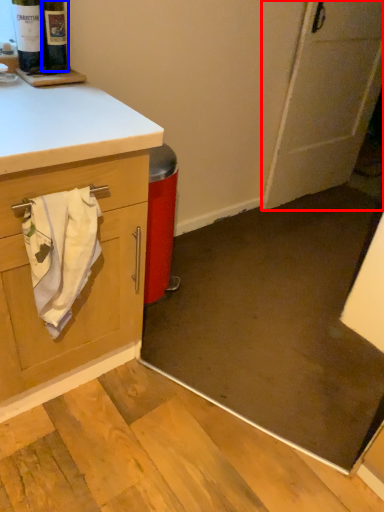
Question: Among these objects, which one is farthest to the camera, door (highlighted by a red box) or wine bottle (highlighted by a blue box)?

Choices:
 (A) door
 (B) wine bottle

Answer: (A)